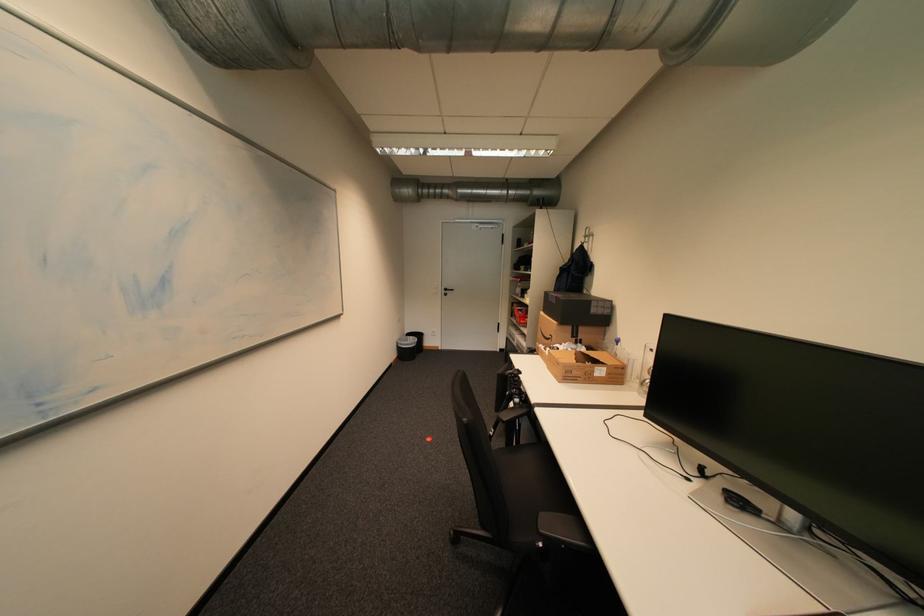
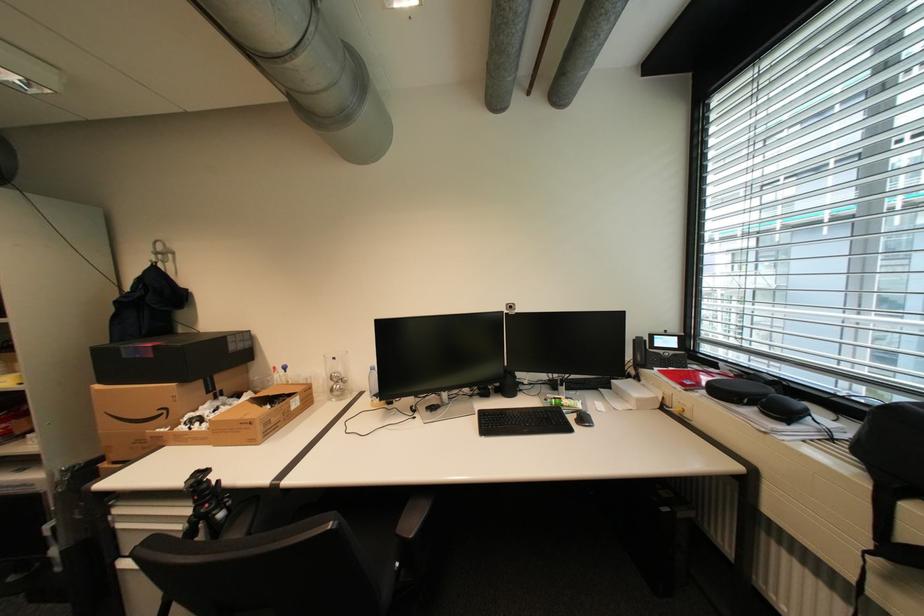
Find the pixel in the second image that matches the point at 563,302 in the first image.

(161, 357)